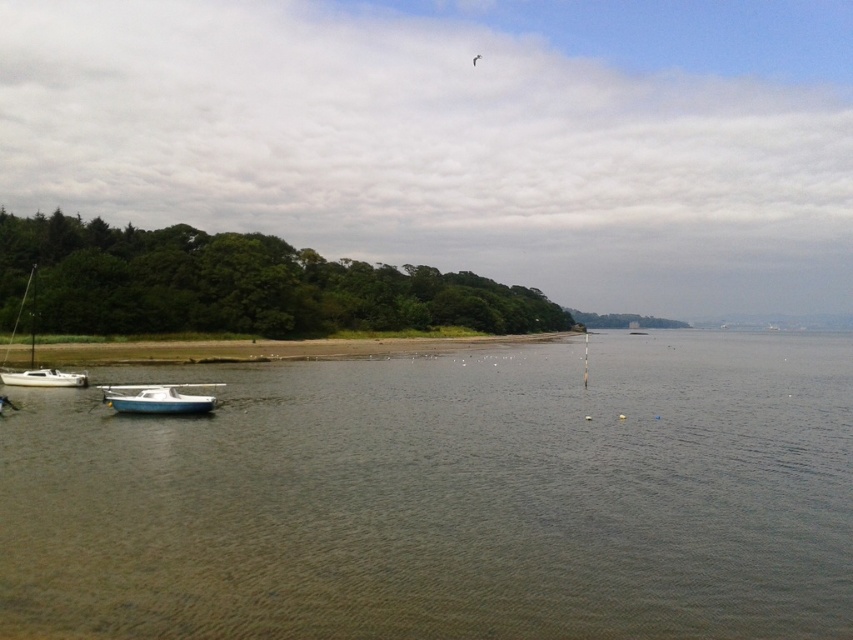
From the picture: Does brown matte water at center have a lesser width compared to white matte sailboat at left?

No, brown matte water at center is not thinner than white matte sailboat at left.

Does brown matte water at center have a lesser height compared to white matte sailboat at left?

Yes.

Find the location of a particular element. The image size is (853, 640). brown matte water at center is located at coordinates (447, 499).

At what (x,y) coordinates should I click in order to perform the action: click on brown matte water at center. Please return your answer as a coordinate pair (x, y). The width and height of the screenshot is (853, 640). Looking at the image, I should click on (447, 499).

Which is more to the right, brown matte water at center or white matte boat at lower left?

brown matte water at center

Measure the distance between point (134, 620) and camera.

A distance of 7.95 meters exists between point (134, 620) and camera.

What are the coordinates of `brown matte water at center` in the screenshot? It's located at (447, 499).

Is green leafy trees at left further to camera compared to brown sand at lower center?

That is True.

Who is positioned more to the left, green leafy trees at left or brown sand at lower center?

green leafy trees at left

Where is `green leafy trees at left`? green leafy trees at left is located at coordinates (236, 285).